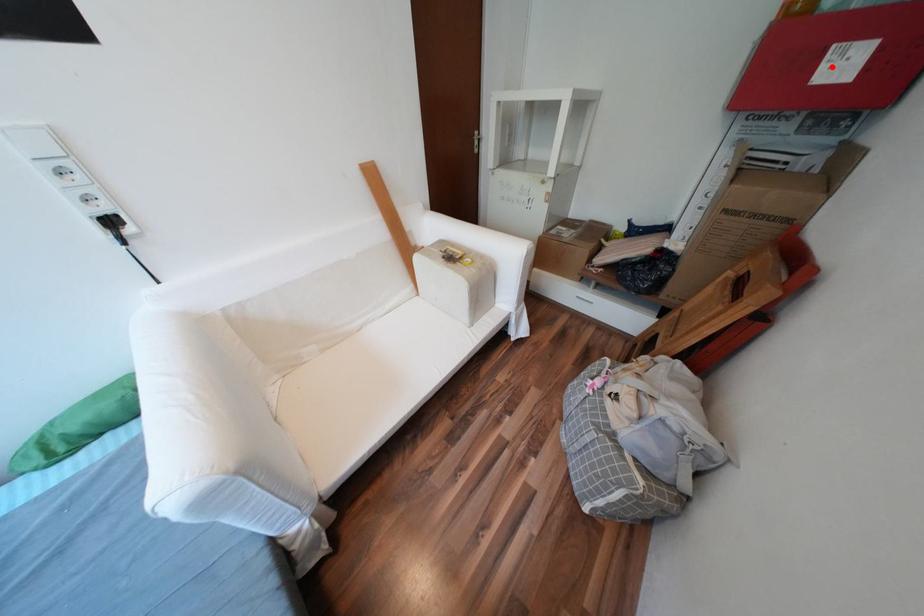
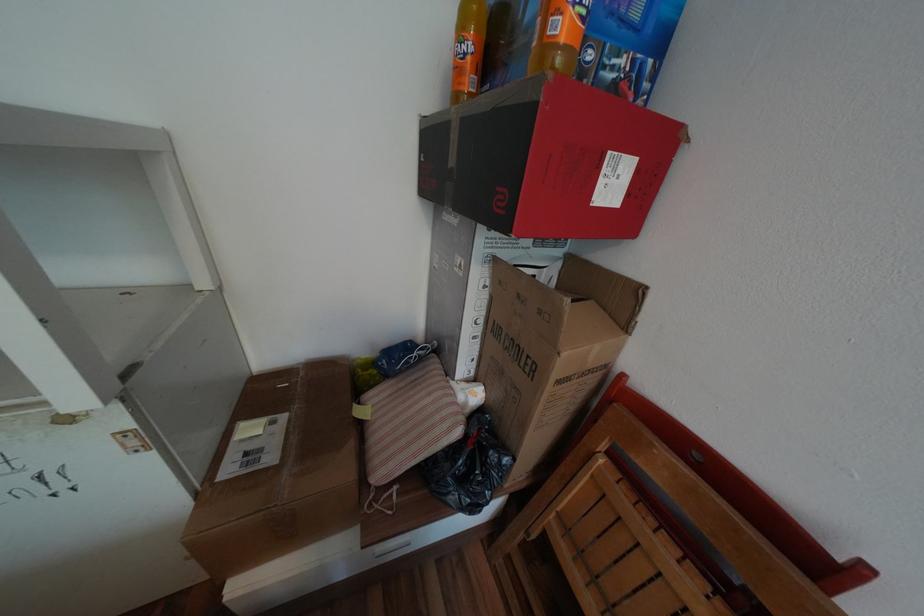
Locate, in the second image, the point that corresponds to the highlighted location in the first image.

(611, 182)